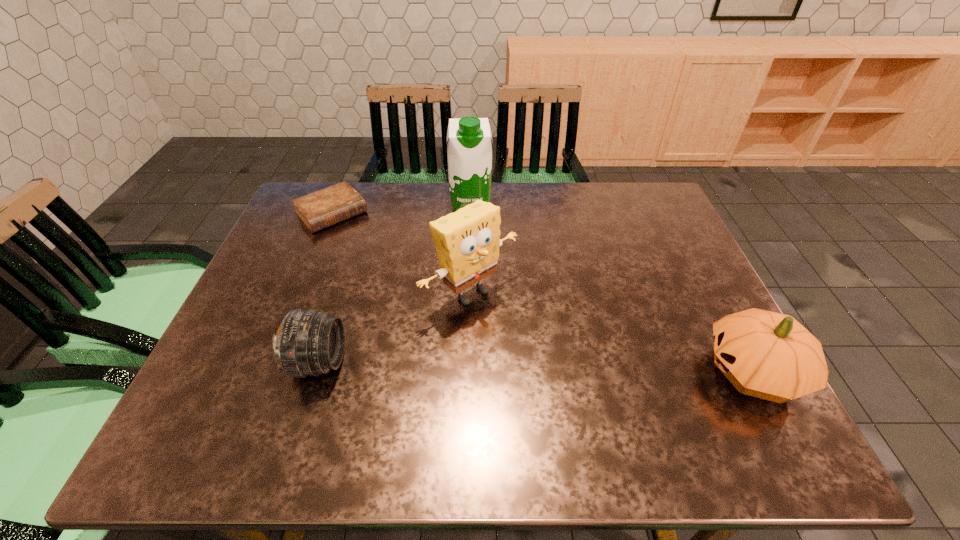
The width and height of the screenshot is (960, 540). Find the location of `blank area located on the side of the rightmost object with the carved face`. blank area located on the side of the rightmost object with the carved face is located at coordinates (648, 372).

Identify the location of vacant area situated on the spine side of the shortest object. (420, 308).

In order to click on vacant space located on the spine side of the shortest object in this screenshot , I will do `click(423, 310)`.

Locate an element on the screen. vacant space situated 0.200m on the spine side of the shortest object is located at coordinates (382, 267).

Image resolution: width=960 pixels, height=540 pixels. Identify the location of vacant area situated on the front-facing side of the soya milk. (477, 310).

In order to click on vacant area situated on the front-facing side of the soya milk in this screenshot , I will do `click(474, 266)`.

At what (x,y) coordinates should I click in order to perform the action: click on vacant space located on the front-facing side of the soya milk. Please return your answer as a coordinate pair (x, y). The width and height of the screenshot is (960, 540). Looking at the image, I should click on (475, 279).

Where is `vacant space located 0.210m on the face of the sponge`? The width and height of the screenshot is (960, 540). vacant space located 0.210m on the face of the sponge is located at coordinates (565, 374).

Locate an element on the screen. The width and height of the screenshot is (960, 540). vacant space situated 0.120m on the face of the sponge is located at coordinates (536, 347).

Image resolution: width=960 pixels, height=540 pixels. What are the coordinates of `vacant space located on the face of the sponge` in the screenshot? It's located at (584, 389).